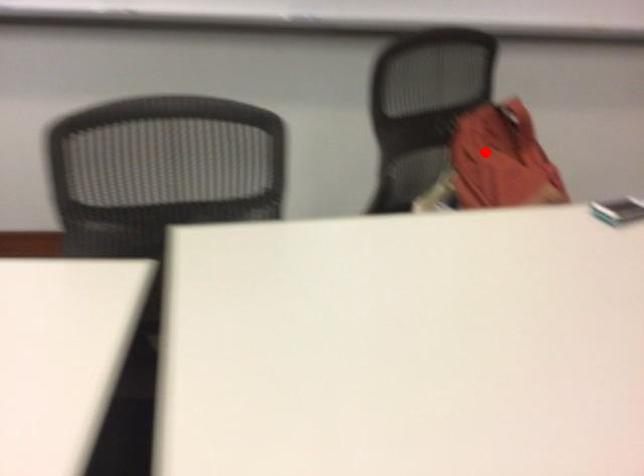
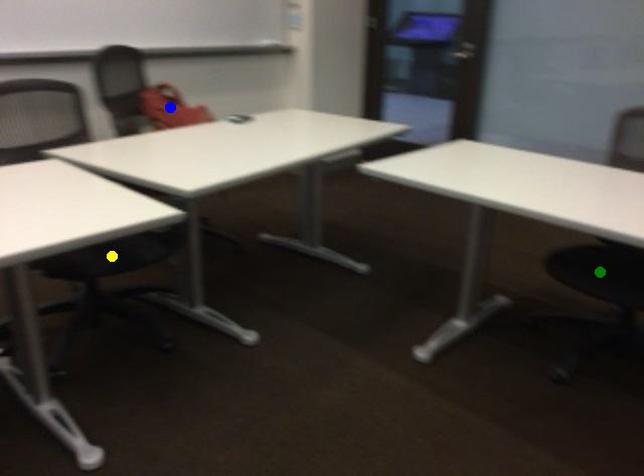
Question: I am providing you with two images of the same scene from different viewpoints. A red point is marked on the first image. You are given multiple points on the second image. Which point in image 2 represents the same 3d spot as the red point in image 1?

Choices:
 (A) yellow point
 (B) green point
 (C) blue point

Answer: (C)